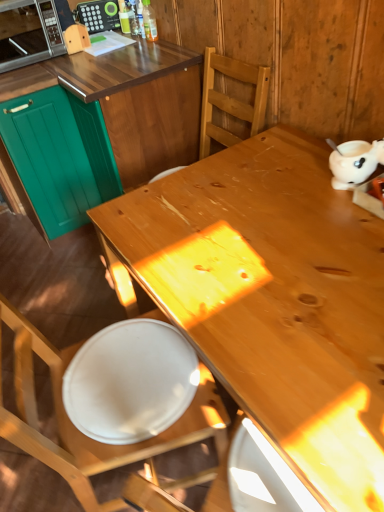
The image size is (384, 512). Identify the location of free region on the left part of translucent plastic bottle at upper center. (116, 45).